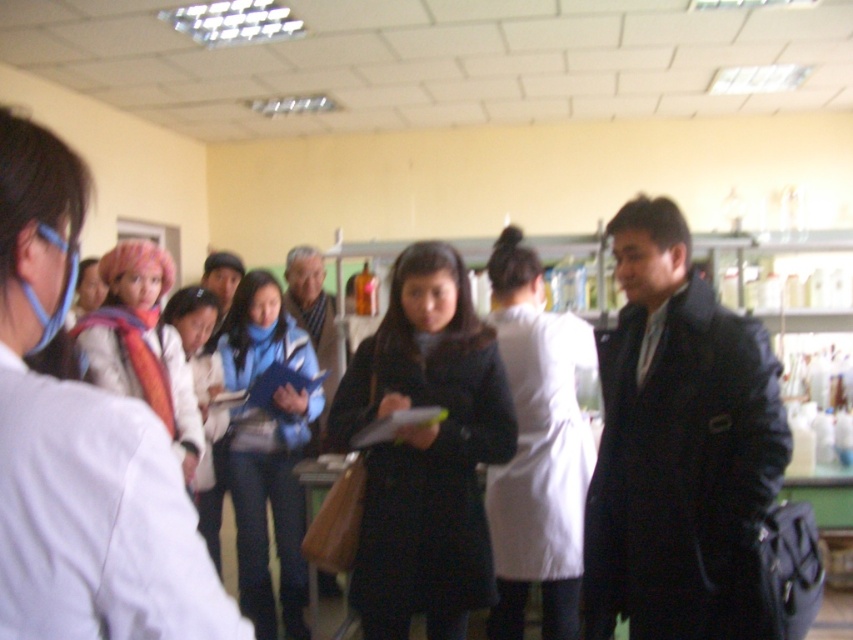
You are standing in the laboratory scene and need to reach both the point at coordinates (730,508) and the point at (180,420). Which point should you move towards first if you want to reach the one closer to you first?

You should move towards point (730,508) first because it is closer to you than point (180,420).

In the scene shown: You are a researcher in this lab and need to reach a beaker placed between the black matte lab coat at center and the white lab coat at center. The beaker is exactly halfway between them. If your arm can extend 24 inches, can you comfortably reach it without moving either coat?

The distance between the black matte lab coat at center and the white lab coat at center is 23.51 inches. Since the beaker is halfway, it is 11.755 inches from each coat. Your arm can extend 24 inches, so yes, you can comfortably reach the beaker without moving either coat.